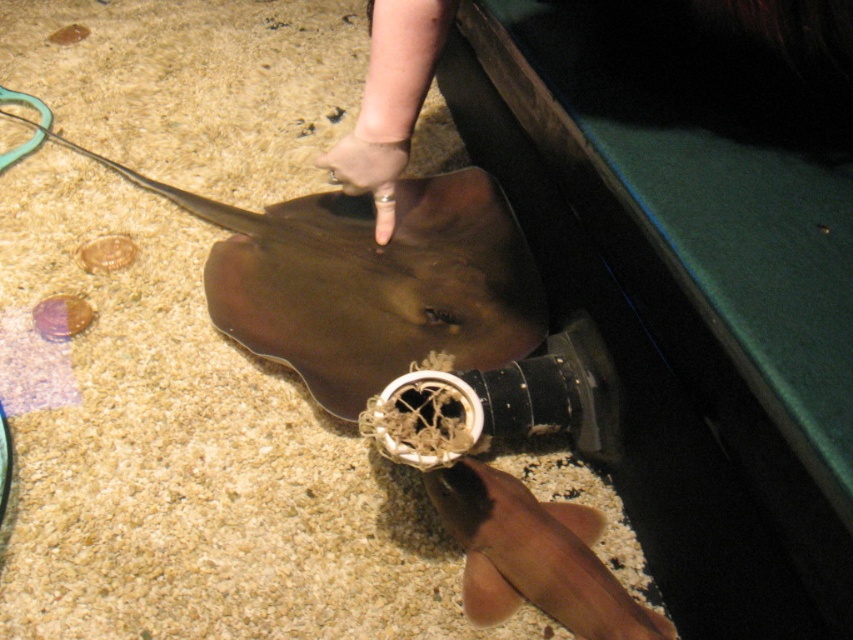
From the picture: You are a marine biologist observing an aquarium. You notice the brown matte stingray at center and the smooth brown shark at lower center. Which of these two marine animals is located to the right side in the aquarium?

The smooth brown shark at lower center is located to the right side because the brown matte stingray at center is positioned on the left side of it.

You are a marine biologist observing an aquarium. You notice the brown matte stingray at center and the smooth brown shark at lower center. Which of these two marine animals is taller in the image?

The brown matte stingray at center is taller than the smooth brown shark at lower center.

What is located at the coordinates point (380, 285) in the underwater aquarium scene?

The brown matte stingray at center is located at point (380, 285).